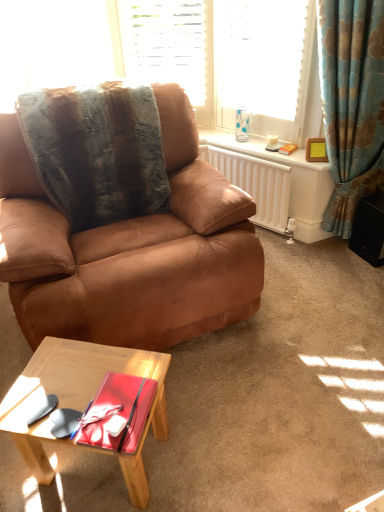
Find the location of a particular element. Image resolution: width=384 pixels, height=512 pixels. vacant space that is to the left of translucent glass coffee cup at upper right is located at coordinates (255, 144).